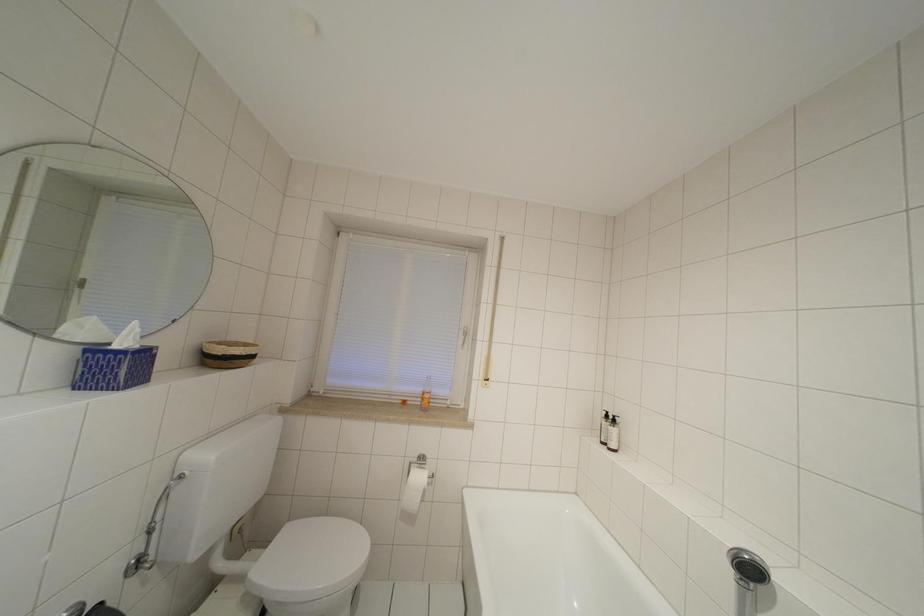
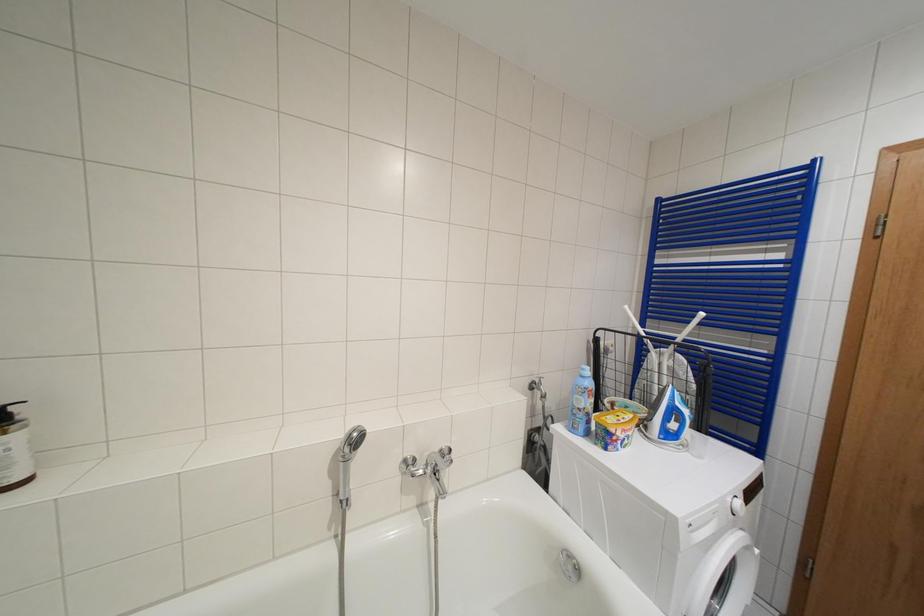
Question: The first image is from the beginning of the video and the second image is from the end. How did the camera likely rotate when shooting the video?

Choices:
 (A) Left
 (B) Right
 (C) Up
 (D) Down

Answer: (B)